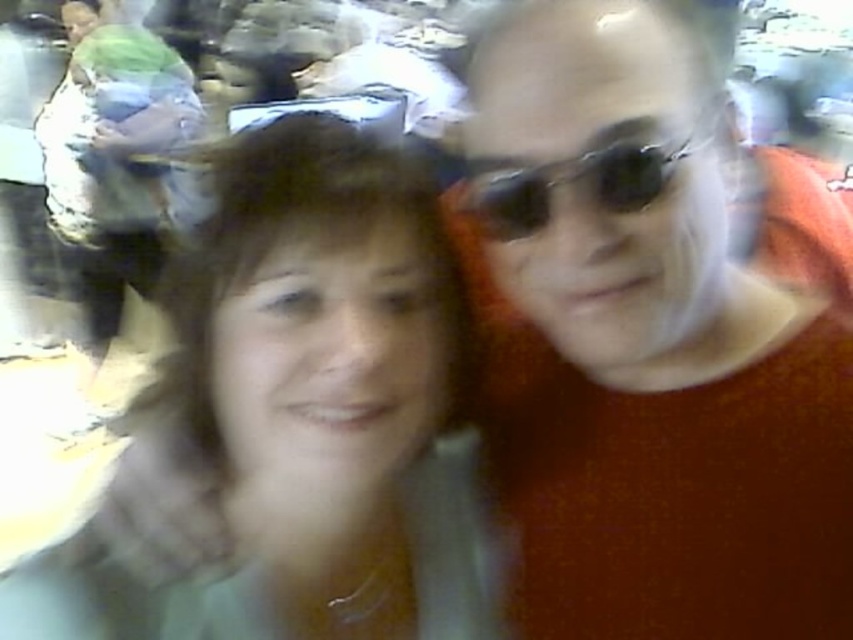
Question: From the image, what is the correct spatial relationship of orange matte sweater at right in relation to sunglasses at center?

Choices:
 (A) below
 (B) above

Answer: (A)

Question: Which object appears closest to the camera in this image?

Choices:
 (A) sunglasses at center
 (B) orange matte sweater at right

Answer: (B)

Question: Does orange matte sweater at right lie behind sunglasses at center?

Choices:
 (A) no
 (B) yes

Answer: (A)

Question: Is orange matte sweater at right below sunglasses at center?

Choices:
 (A) no
 (B) yes

Answer: (B)